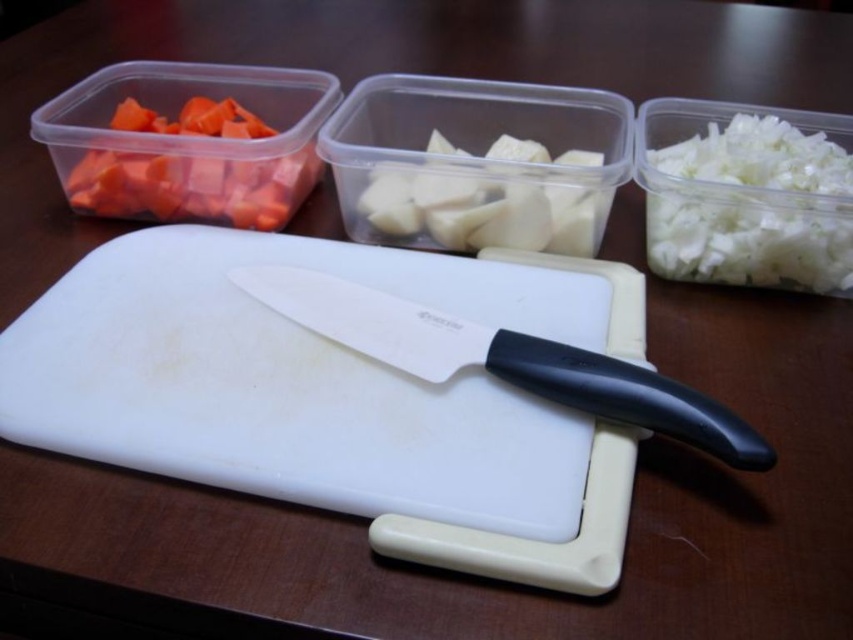
Question: Which of the following is the closest to the observer?

Choices:
 (A) (834, 148)
 (B) (486, 209)

Answer: (B)

Question: In this image, where is white shredded onion at right located relative to black plastic knife at center?

Choices:
 (A) left
 (B) right

Answer: (B)

Question: Can you confirm if white plastic cutting board at center is bigger than black plastic knife at center?

Choices:
 (A) no
 (B) yes

Answer: (B)

Question: Which is nearer to the orange matte carrot at upper left?

Choices:
 (A) black plastic knife at center
 (B) white plastic cutting board at center

Answer: (B)

Question: Which point is farther from the camera taking this photo?

Choices:
 (A) pyautogui.click(x=157, y=164)
 (B) pyautogui.click(x=590, y=152)
 (C) pyautogui.click(x=343, y=262)
 (D) pyautogui.click(x=334, y=292)

Answer: (B)

Question: From the image, what is the correct spatial relationship of white shredded onion at right in relation to black plastic knife at center?

Choices:
 (A) above
 (B) below

Answer: (A)